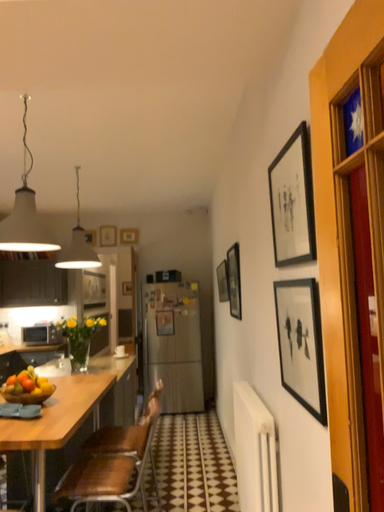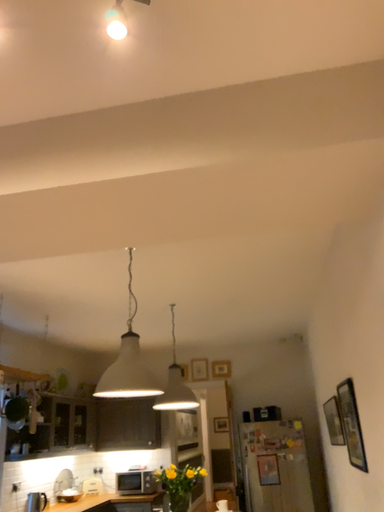
Question: How did the camera likely rotate when shooting the video?

Choices:
 (A) rotated right
 (B) rotated left

Answer: (B)